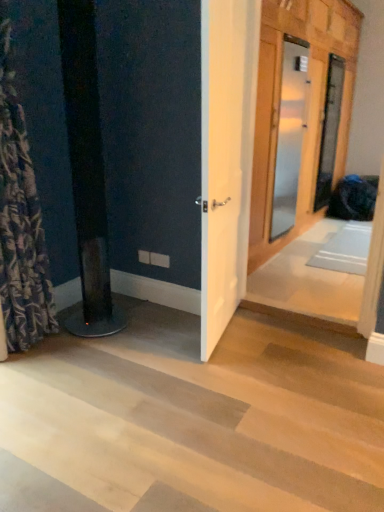
Question: From the image's perspective, is patterned fabric shower curtain at left located above or below wooden door at center, placed as the third door when sorted from right to left?

Choices:
 (A) above
 (B) below

Answer: (B)

Question: From a real-world perspective, is patterned fabric shower curtain at left above or below wooden door at center, placed as the third door when sorted from right to left?

Choices:
 (A) below
 (B) above

Answer: (A)

Question: Which of these objects is positioned farthest from the wooden door at center, arranged as the 2th door when viewed from the left?

Choices:
 (A) patterned fabric shower curtain at left
 (B) wooden door at center, marked as the first door in a right-to-left arrangement
 (C) black glossy speaker at left
 (D) natural wood stairwell at lower left
 (E) wooden door at center, placed as the third door when sorted from right to left

Answer: (A)

Question: Based on their relative distances, which object is nearer to the black glossy speaker at left?

Choices:
 (A) wooden door at center, arranged as the 3th door when viewed from the left
 (B) wooden door at center, marked as the second door in a right-to-left arrangement
 (C) natural wood stairwell at lower left
 (D) wooden door at center, placed as the third door when sorted from right to left
 (E) patterned fabric shower curtain at left

Answer: (E)